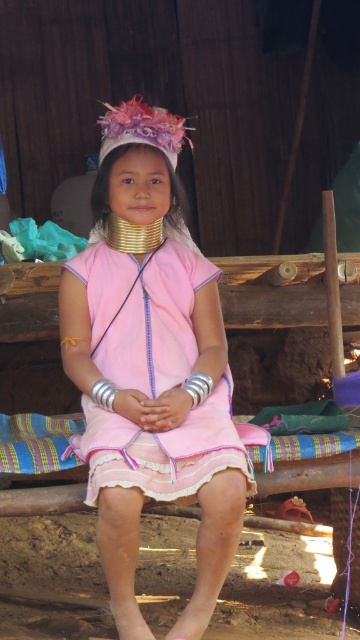
Who is shorter, fuzzy pink headdress at center or gold metallic neck piece at center?

gold metallic neck piece at center

Does fuzzy pink headdress at center have a larger size compared to gold metallic neck piece at center?

Correct, fuzzy pink headdress at center is larger in size than gold metallic neck piece at center.

The image size is (360, 640). What do you see at coordinates (141, 131) in the screenshot? I see `fuzzy pink headdress at center` at bounding box center [141, 131].

The image size is (360, 640). Identify the location of fuzzy pink headdress at center. (141, 131).

Can you confirm if pink matte dress at center is taller than pink satin dress at center?

Indeed, pink matte dress at center has a greater height compared to pink satin dress at center.

Is pink matte dress at center further to the viewer compared to pink satin dress at center?

No.

Locate an element on the screen. Image resolution: width=360 pixels, height=640 pixels. pink matte dress at center is located at coordinates (154, 412).

Is pink matte dress at center to the left of fuzzy pink headdress at center from the viewer's perspective?

Indeed, pink matte dress at center is positioned on the left side of fuzzy pink headdress at center.

Can you confirm if pink matte dress at center is positioned above fuzzy pink headdress at center?

Incorrect, pink matte dress at center is not positioned above fuzzy pink headdress at center.

Locate an element on the screen. pink matte dress at center is located at coordinates [x=154, y=412].